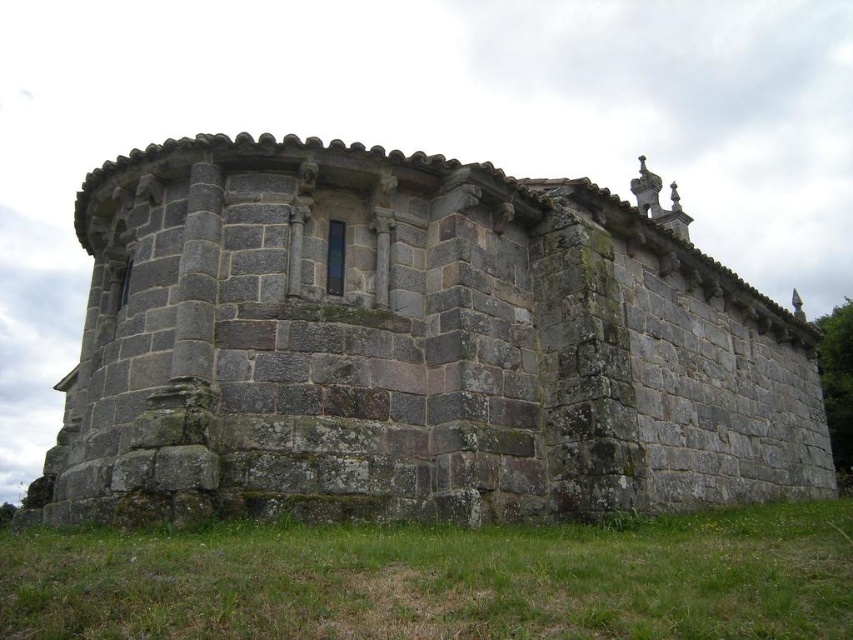
Question: Is gray stone building at center smaller than green grass at lower center?

Choices:
 (A) yes
 (B) no

Answer: (B)

Question: Does gray stone building at center appear on the right side of green grass at lower center?

Choices:
 (A) yes
 (B) no

Answer: (A)

Question: Can you confirm if gray stone building at center is wider than green grass at lower center?

Choices:
 (A) yes
 (B) no

Answer: (A)

Question: Which object appears farthest from the camera in this image?

Choices:
 (A) green grass at lower center
 (B) gray stone building at center

Answer: (B)